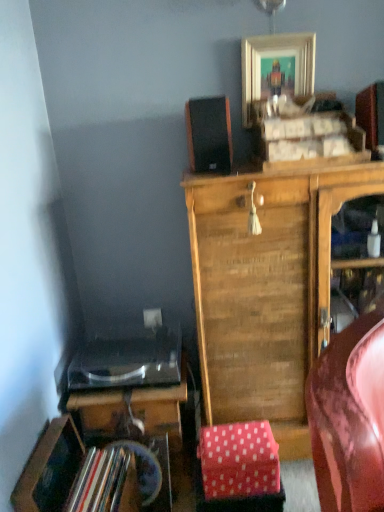
Question: Is wooden cabinet at center situated inside pink polka dot fabric at lower center or outside?

Choices:
 (A) outside
 (B) inside

Answer: (A)

Question: Looking at the image, does wooden cabinet at center seem bigger or smaller compared to pink polka dot fabric at lower center?

Choices:
 (A) big
 (B) small

Answer: (A)

Question: Which object is the farthest from the pink polka dot fabric at lower center?

Choices:
 (A) shiny black desk at lower left
 (B) black matte speaker at upper center
 (C) wooden cabinet at center
 (D) gold metallic picture frame at upper center

Answer: (D)

Question: Which is nearer to the pink polka dot fabric at lower center?

Choices:
 (A) gold metallic picture frame at upper center
 (B) wooden cabinet at center
 (C) black matte speaker at upper center
 (D) shiny black desk at lower left

Answer: (D)